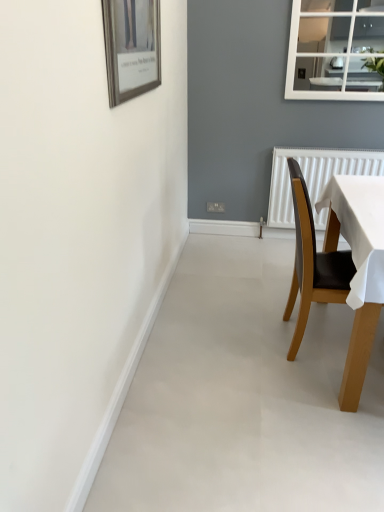
Question: Relative to wooden-framed picture at upper left, is brown wooden chair at right in front or behind?

Choices:
 (A) behind
 (B) front

Answer: (A)

Question: Considering the positions of brown wooden chair at right and wooden-framed picture at upper left in the image, is brown wooden chair at right bigger or smaller than wooden-framed picture at upper left?

Choices:
 (A) big
 (B) small

Answer: (A)

Question: From the image's perspective, is brown wooden chair at right located above or below wooden-framed picture at upper left?

Choices:
 (A) above
 (B) below

Answer: (B)

Question: Is wooden-framed picture at upper left bigger or smaller than brown wooden chair at right?

Choices:
 (A) big
 (B) small

Answer: (B)

Question: Is point (140, 2) closer or farther from the camera than point (304, 284)?

Choices:
 (A) closer
 (B) farther

Answer: (A)

Question: From the image's perspective, relative to brown wooden chair at right, is wooden-framed picture at upper left above or below?

Choices:
 (A) above
 (B) below

Answer: (A)

Question: Considering the positions of wooden-framed picture at upper left and brown wooden chair at right in the image, is wooden-framed picture at upper left taller or shorter than brown wooden chair at right?

Choices:
 (A) short
 (B) tall

Answer: (A)